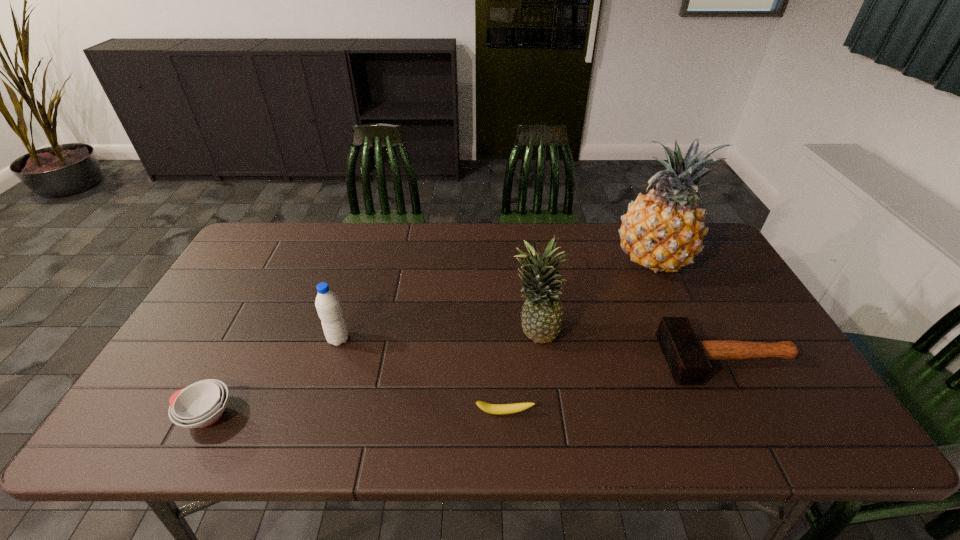
Identify the location of vacant space that is in between the leftmost object and the left pineapple. This screenshot has height=540, width=960. (371, 373).

This screenshot has height=540, width=960. Find the location of `object that stands as the second closest to the shortest object`. object that stands as the second closest to the shortest object is located at coordinates (687, 357).

The image size is (960, 540). I want to click on object that is the fifth closest one to the water bottle, so click(x=687, y=357).

Where is `free point that satisfies the following two spatial constraints: 1. on the hammer head face of the mallet; 2. on the upward curve of the shortest object`? free point that satisfies the following two spatial constraints: 1. on the hammer head face of the mallet; 2. on the upward curve of the shortest object is located at coordinates (756, 413).